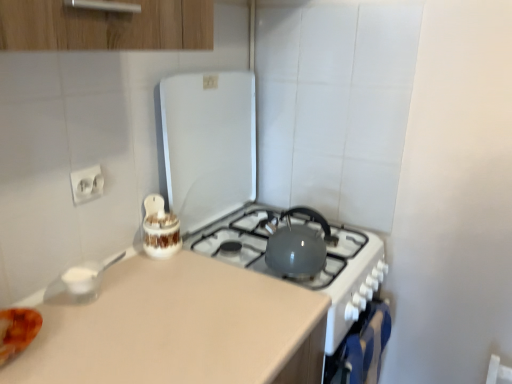
Question: Should I look upward or downward to see blue fabric oven at lower right?

Choices:
 (A) up
 (B) down

Answer: (B)

Question: Does white glossy jar at center, arranged as the first appliance when viewed from the left, have a greater height compared to matte gray kettle at center, acting as the first appliance starting from the right?

Choices:
 (A) yes
 (B) no

Answer: (B)

Question: Does white glossy jar at center, positioned as the second appliance in right-to-left order, have a larger size compared to matte gray kettle at center, placed as the second appliance when sorted from left to right?

Choices:
 (A) no
 (B) yes

Answer: (A)

Question: From the image's perspective, would you say white glossy jar at center, positioned as the second appliance in right-to-left order, is shown under matte gray kettle at center, placed as the second appliance when sorted from left to right?

Choices:
 (A) no
 (B) yes

Answer: (B)

Question: Is white glossy jar at center, arranged as the first appliance when viewed from the left, at the left side of matte gray kettle at center, acting as the first appliance starting from the right?

Choices:
 (A) no
 (B) yes

Answer: (B)

Question: Can we say white glossy jar at center, arranged as the first appliance when viewed from the left, lies outside matte gray kettle at center, acting as the first appliance starting from the right?

Choices:
 (A) no
 (B) yes

Answer: (B)

Question: Can you confirm if white glossy jar at center, positioned as the second appliance in right-to-left order, is wider than matte gray kettle at center, acting as the first appliance starting from the right?

Choices:
 (A) no
 (B) yes

Answer: (A)

Question: Is white glossy jar at center, positioned as the second appliance in right-to-left order, in contact with blue fabric oven at lower right?

Choices:
 (A) no
 (B) yes

Answer: (A)

Question: Can you confirm if white glossy jar at center, positioned as the second appliance in right-to-left order, is shorter than blue fabric oven at lower right?

Choices:
 (A) yes
 (B) no

Answer: (A)

Question: Are white glossy jar at center, arranged as the first appliance when viewed from the left, and blue fabric oven at lower right far apart?

Choices:
 (A) no
 (B) yes

Answer: (A)

Question: Is blue fabric oven at lower right at the back of white glossy jar at center, positioned as the second appliance in right-to-left order?

Choices:
 (A) yes
 (B) no

Answer: (B)

Question: Is white glossy jar at center, positioned as the second appliance in right-to-left order, taller than blue fabric oven at lower right?

Choices:
 (A) no
 (B) yes

Answer: (A)

Question: Does white glossy jar at center, arranged as the first appliance when viewed from the left, have a lesser width compared to blue fabric oven at lower right?

Choices:
 (A) yes
 (B) no

Answer: (B)

Question: Is blue fabric oven at lower right at the right side of white glossy electric outlet at upper left?

Choices:
 (A) no
 (B) yes

Answer: (B)